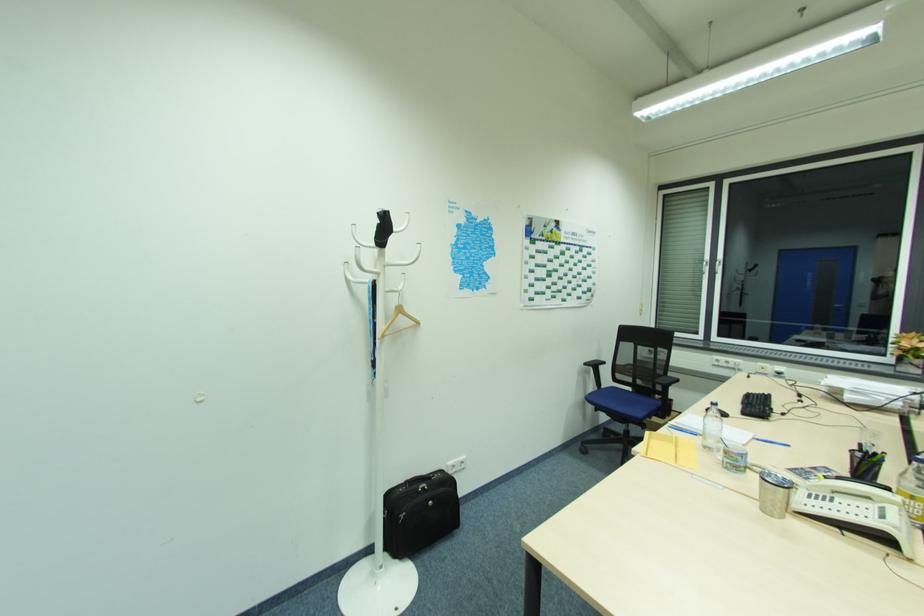
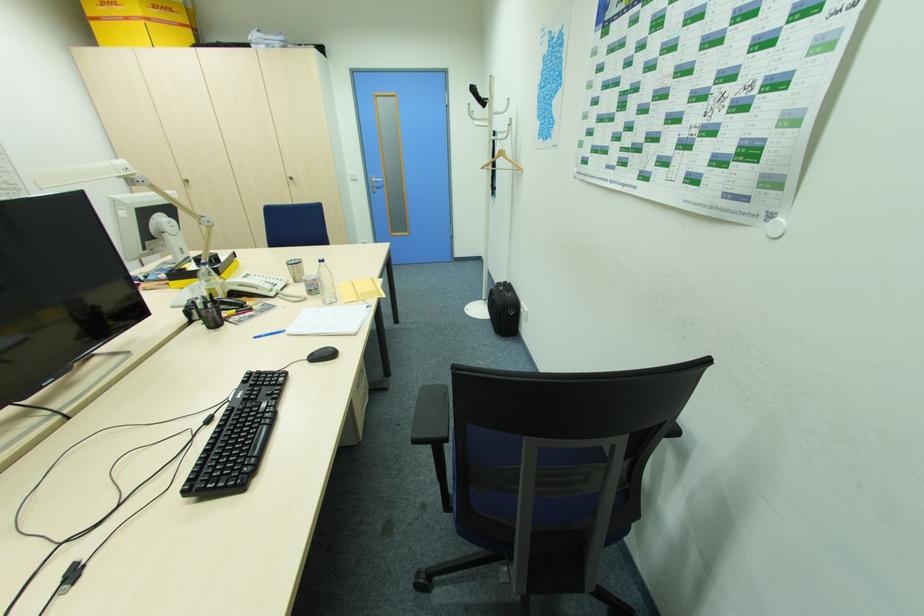
In the second image, find the point that corresponds to [383,256] in the first image.

(493, 113)